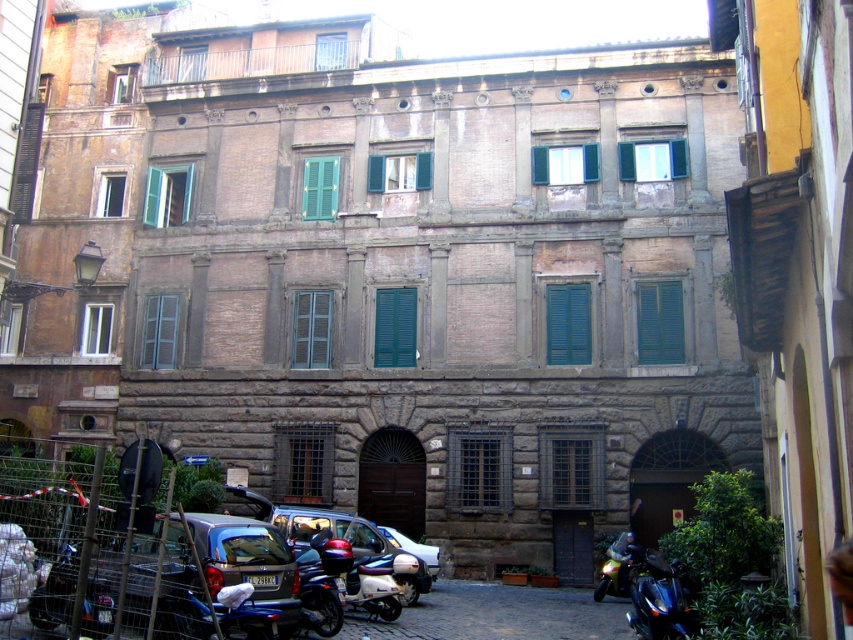
Question: Estimate the real-world distances between objects in this image. Which object is farther from the metallic silver scooter at lower center?

Choices:
 (A) shiny black motorcycle at center
 (B) matte blue car at center

Answer: (B)

Question: Can you confirm if shiny blue motorcycle at lower right is positioned below shiny black motorcycle at center?

Choices:
 (A) no
 (B) yes

Answer: (B)

Question: Which point is closer to the camera taking this photo?

Choices:
 (A) (653, 566)
 (B) (323, 534)
 (C) (410, 552)
 (D) (352, 577)

Answer: (A)

Question: Is shiny blue motorcycle at lower right to the left of shiny black motorcycle at center from the viewer's perspective?

Choices:
 (A) yes
 (B) no

Answer: (B)

Question: Does metallic silver scooter at lower center have a smaller size compared to shiny black motorcycle at center?

Choices:
 (A) no
 (B) yes

Answer: (A)

Question: Which point is farther from the camera taking this photo?

Choices:
 (A) (631, 612)
 (B) (292, 529)
 (C) (323, 534)
 (D) (349, 600)

Answer: (B)